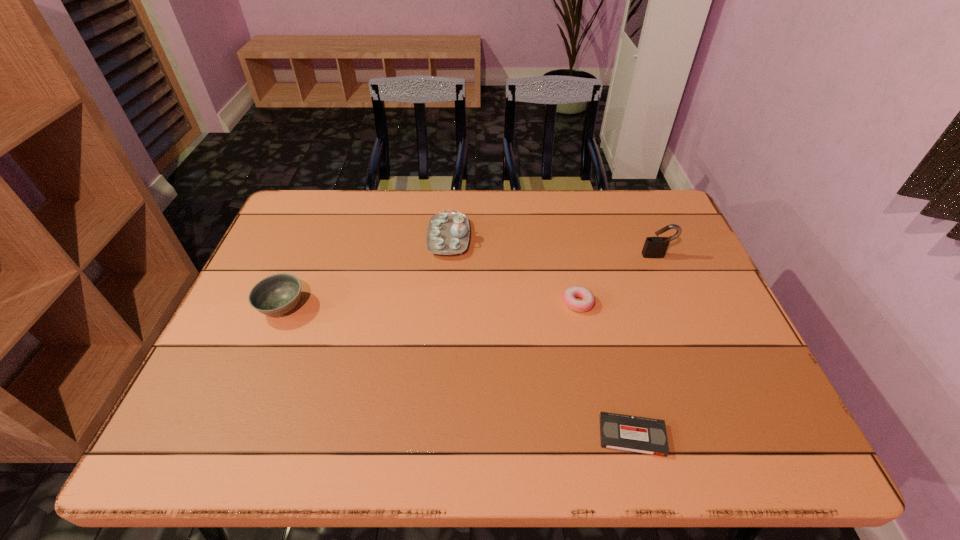
Identify the location of vacant point located between the videotape and the doughnut. The height and width of the screenshot is (540, 960). (605, 369).

This screenshot has width=960, height=540. What are the coordinates of `vacant space that's between the tallest object and the second object from left to right` in the screenshot? It's located at (553, 247).

The width and height of the screenshot is (960, 540). I want to click on vacant area between the doughnut and the third tallest object, so click(430, 305).

Where is `free spot between the leftmost object and the second shortest object`? free spot between the leftmost object and the second shortest object is located at coordinates (430, 305).

Where is `vacant area that lies between the doughnut and the padlock`? The width and height of the screenshot is (960, 540). vacant area that lies between the doughnut and the padlock is located at coordinates (617, 279).

Identify the location of free space between the tallest object and the second object from left to right. The width and height of the screenshot is (960, 540). [x=553, y=247].

Locate which object is the fourth closest to the rightmost object. Please provide its 2D coordinates. Your answer should be formatted as a tuple, i.e. [(x, y)], where the tuple contains the x and y coordinates of a point satisfying the conditions above.

[(277, 294)]

Point out which object is positioned as the nearest to the third shortest object. Please provide its 2D coordinates. Your answer should be formatted as a tuple, i.e. [(x, y)], where the tuple contains the x and y coordinates of a point satisfying the conditions above.

[(448, 233)]

I want to click on vacant area in the image that satisfies the following two spatial constraints: 1. on the back side of the doughnut; 2. on the left side of the bowl, so click(x=284, y=303).